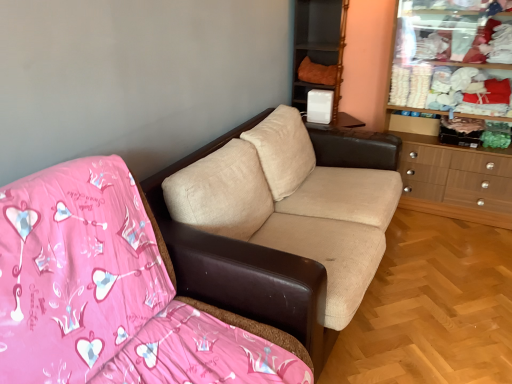
Question: Can you confirm if wooden dresser at right is wider than beige fabric couch at center, which is counted as the 1th studio couch, starting from the back?

Choices:
 (A) yes
 (B) no

Answer: (B)

Question: Does wooden dresser at right lie behind beige fabric couch at center, which is counted as the 1th studio couch, starting from the back?

Choices:
 (A) no
 (B) yes

Answer: (B)

Question: From the image's perspective, is wooden dresser at right on top of beige fabric couch at center, which is the second studio couch from front to back?

Choices:
 (A) no
 (B) yes

Answer: (B)

Question: Does wooden dresser at right have a smaller size compared to beige fabric couch at center, which is the second studio couch from front to back?

Choices:
 (A) yes
 (B) no

Answer: (B)

Question: Are wooden dresser at right and beige fabric couch at center, which is counted as the 1th studio couch, starting from the back, located far from each other?

Choices:
 (A) no
 (B) yes

Answer: (B)

Question: Is wooden dresser at right aimed at beige fabric couch at center, which is the second studio couch from front to back?

Choices:
 (A) no
 (B) yes

Answer: (B)

Question: Could you tell me if beige fabric couch at center, arranged as the 2th studio couch when viewed from the back, is turned towards beige fabric couch at center, which is counted as the 1th studio couch, starting from the back?

Choices:
 (A) no
 (B) yes

Answer: (A)

Question: From a real-world perspective, is beige fabric couch at center, arranged as the 2th studio couch when viewed from the back, positioned under beige fabric couch at center, which is counted as the 1th studio couch, starting from the back, based on gravity?

Choices:
 (A) yes
 (B) no

Answer: (B)

Question: Could beige fabric couch at center, which is counted as the 1th studio couch, starting from the back, be considered to be inside beige fabric couch at center, the first studio couch when ordered from front to back?

Choices:
 (A) yes
 (B) no

Answer: (B)

Question: Is beige fabric couch at center, arranged as the 2th studio couch when viewed from the back, not inside beige fabric couch at center, which is counted as the 1th studio couch, starting from the back?

Choices:
 (A) no
 (B) yes

Answer: (B)

Question: Can you confirm if beige fabric couch at center, arranged as the 2th studio couch when viewed from the back, is thinner than beige fabric couch at center, which is the second studio couch from front to back?

Choices:
 (A) yes
 (B) no

Answer: (A)

Question: Can you confirm if beige fabric couch at center, the first studio couch when ordered from front to back, is taller than beige fabric couch at center, which is counted as the 1th studio couch, starting from the back?

Choices:
 (A) no
 (B) yes

Answer: (B)

Question: Considering the relative sizes of beige fabric couch at center, which is counted as the 1th studio couch, starting from the back, and orange fabric cushion at upper center in the image provided, is beige fabric couch at center, which is counted as the 1th studio couch, starting from the back, shorter than orange fabric cushion at upper center?

Choices:
 (A) yes
 (B) no

Answer: (A)